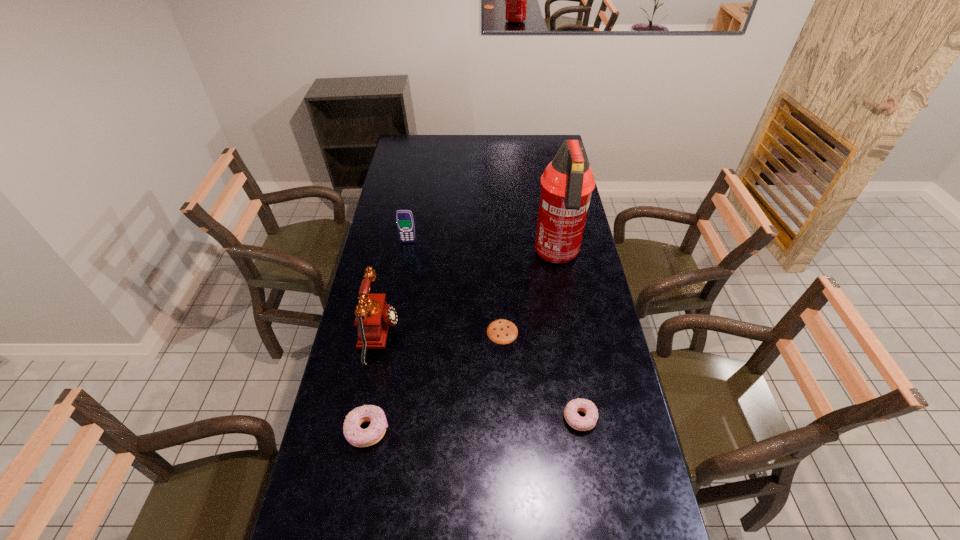
Image resolution: width=960 pixels, height=540 pixels. In order to click on free space at the far edge of the desktop in this screenshot , I will do `click(429, 147)`.

Where is `vacant space at the near edge of the desktop`? The height and width of the screenshot is (540, 960). vacant space at the near edge of the desktop is located at coordinates (567, 512).

Where is `vacant space at the left edge of the desktop`? vacant space at the left edge of the desktop is located at coordinates (390, 194).

This screenshot has width=960, height=540. What are the coordinates of `free space at the right edge of the desktop` in the screenshot? It's located at (590, 259).

Locate an element on the screen. This screenshot has height=540, width=960. empty location between the telephone and the cookie is located at coordinates (441, 334).

The image size is (960, 540). Find the location of `vacant area that lies between the tallest object and the taller doughnut`. vacant area that lies between the tallest object and the taller doughnut is located at coordinates (462, 343).

The image size is (960, 540). Identify the location of vacant area that lies between the tallest object and the third tallest object. (483, 249).

Where is `unoccupied position between the cellular telephone and the telephone`? The image size is (960, 540). unoccupied position between the cellular telephone and the telephone is located at coordinates (394, 288).

Find the location of a particular element. vacant region between the taller doughnut and the cellular telephone is located at coordinates (388, 336).

Where is `free space between the telephone and the third object from right to left`? The width and height of the screenshot is (960, 540). free space between the telephone and the third object from right to left is located at coordinates (441, 334).